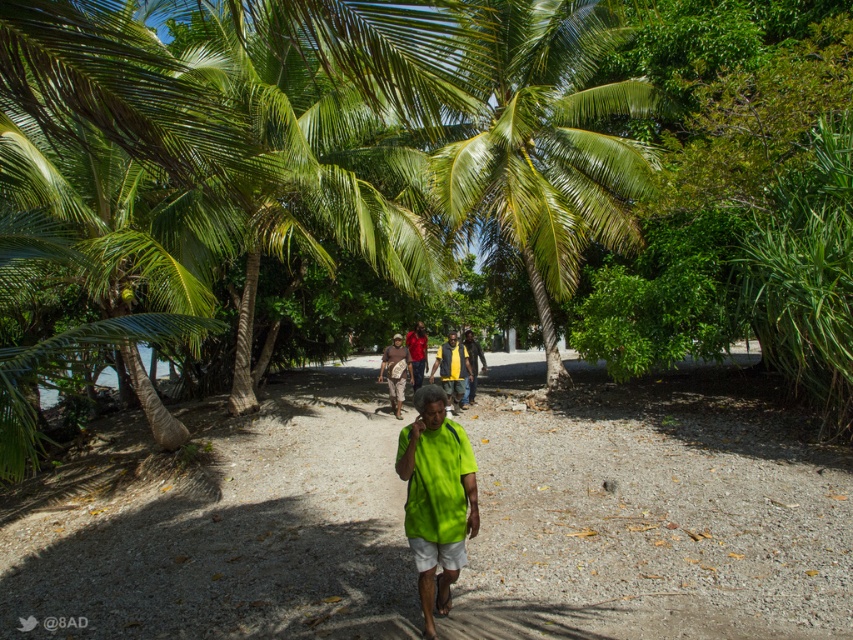
Can you confirm if yellow fabric shirt at center is positioned below matte red shirt at center?

Yes.

Does yellow fabric shirt at center come behind matte red shirt at center?

No, it is in front of matte red shirt at center.

At what (x,y) coordinates should I click in order to perform the action: click on yellow fabric shirt at center. Please return your answer as a coordinate pair (x, y). The image size is (853, 640). Looking at the image, I should click on click(451, 371).

Based on the photo, can you confirm if green leafy palm tree at center is positioned above neon green fabric shirt at center?

Correct, green leafy palm tree at center is located above neon green fabric shirt at center.

Which is above, green leafy palm tree at center or neon green fabric shirt at center?

Positioned higher is green leafy palm tree at center.

Which is behind, point (556, 365) or point (437, 557)?

The point (556, 365) is behind.

Where is `green leafy palm tree at center`? This screenshot has height=640, width=853. green leafy palm tree at center is located at coordinates (546, 145).

Is green fabric shirt at center to the left of brown fabric bag at center from the viewer's perspective?

Incorrect, green fabric shirt at center is not on the left side of brown fabric bag at center.

Is point (543, 627) behind point (404, 358)?

No, it is in front of (404, 358).

Who is more distant from viewer, [129,557] or [398,337]?

Point [398,337]

Find the location of `green fabric shirt at center`. green fabric shirt at center is located at coordinates (651, 509).